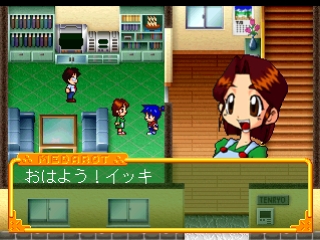
The height and width of the screenshot is (240, 320). In order to click on baseboard in this screenshot , I will do `click(213, 53)`, `click(215, 109)`.